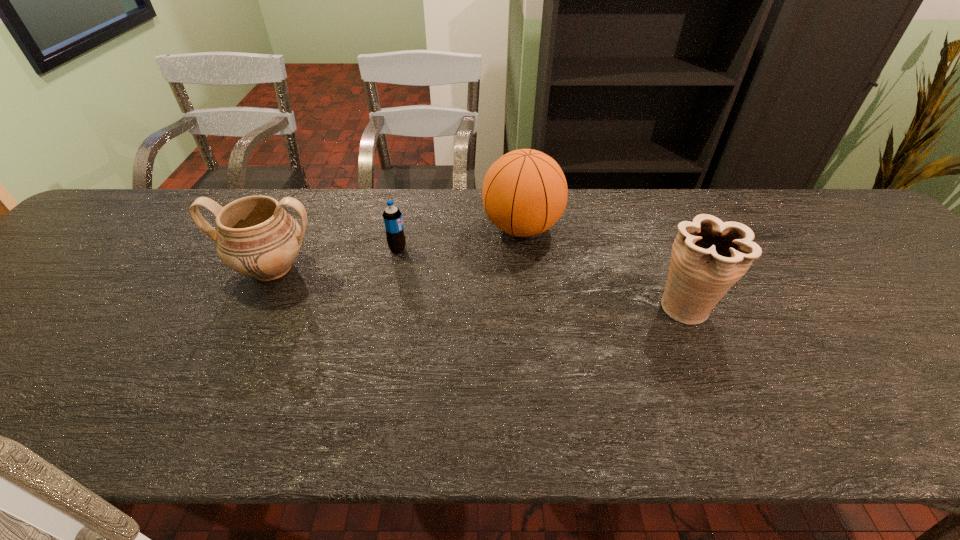
Identify the location of free point between the shortest object and the left urn. This screenshot has width=960, height=540. click(x=335, y=258).

Where is `vacant area that lies between the right urn and the second object from left to right`? The width and height of the screenshot is (960, 540). vacant area that lies between the right urn and the second object from left to right is located at coordinates (542, 278).

Where is `unoccupied position between the rightmost object and the left urn`? unoccupied position between the rightmost object and the left urn is located at coordinates (480, 288).

Locate an element on the screen. The height and width of the screenshot is (540, 960). unoccupied position between the third object from right to left and the leftmost object is located at coordinates point(335,258).

The height and width of the screenshot is (540, 960). I want to click on vacant area that lies between the leftmost object and the shortest object, so click(x=335, y=258).

Locate which object ranks third in proximity to the left urn. Please provide its 2D coordinates. Your answer should be formatted as a tuple, i.e. [(x, y)], where the tuple contains the x and y coordinates of a point satisfying the conditions above.

[(709, 256)]

Choose which object is the nearest neighbor to the basketball. Please provide its 2D coordinates. Your answer should be formatted as a tuple, i.e. [(x, y)], where the tuple contains the x and y coordinates of a point satisfying the conditions above.

[(392, 217)]

Identify the location of vacant space that satisfies the following two spatial constraints: 1. on the front-facing side of the left urn; 2. on the left side of the right urn. (252, 307).

This screenshot has width=960, height=540. I want to click on vacant point that satisfies the following two spatial constraints: 1. on the front-facing side of the left urn; 2. on the left side of the right urn, so [252, 307].

The height and width of the screenshot is (540, 960). Find the location of `free space that satisfies the following two spatial constraints: 1. on the front-facing side of the left urn; 2. on the left side of the rightmost object`. free space that satisfies the following two spatial constraints: 1. on the front-facing side of the left urn; 2. on the left side of the rightmost object is located at coordinates (252, 307).